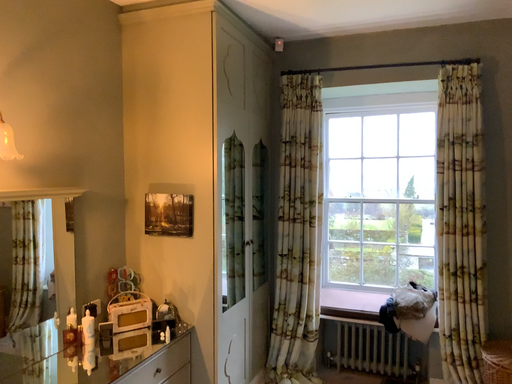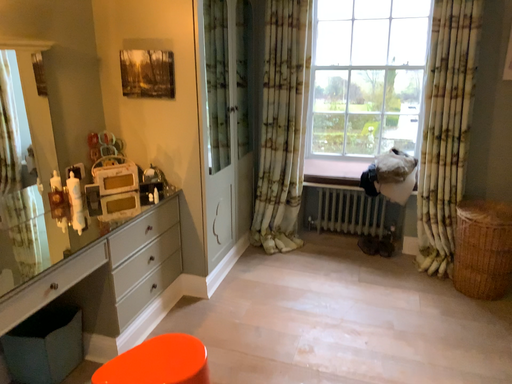
Question: Which way did the camera rotate in the video?

Choices:
 (A) rotated downward
 (B) rotated upward

Answer: (A)